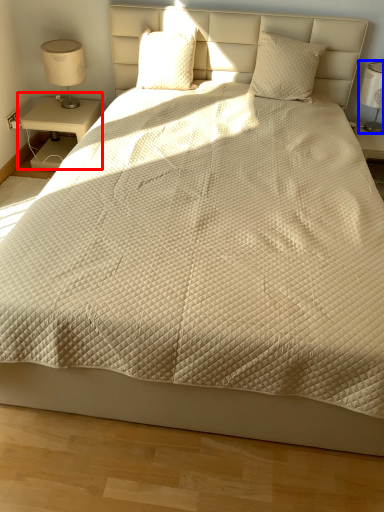
Question: Among these objects, which one is farthest to the camera, nightstand (highlighted by a red box) or bedside lamp (highlighted by a blue box)?

Choices:
 (A) nightstand
 (B) bedside lamp

Answer: (A)